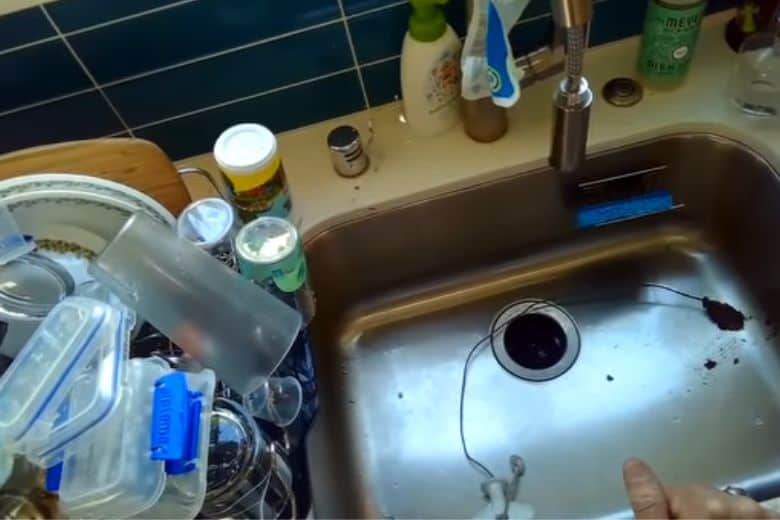
Locate an element on the screen. tubs is located at coordinates (62, 408).